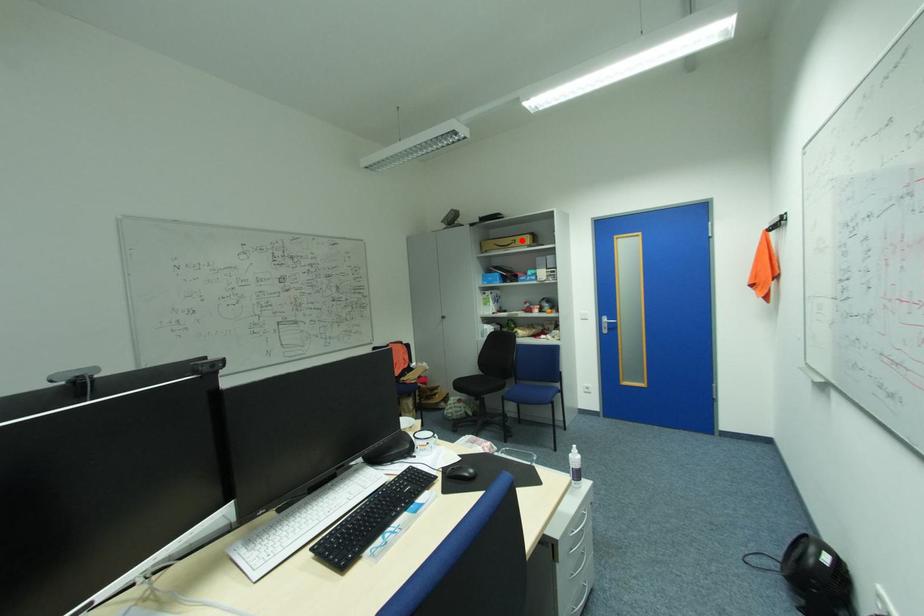
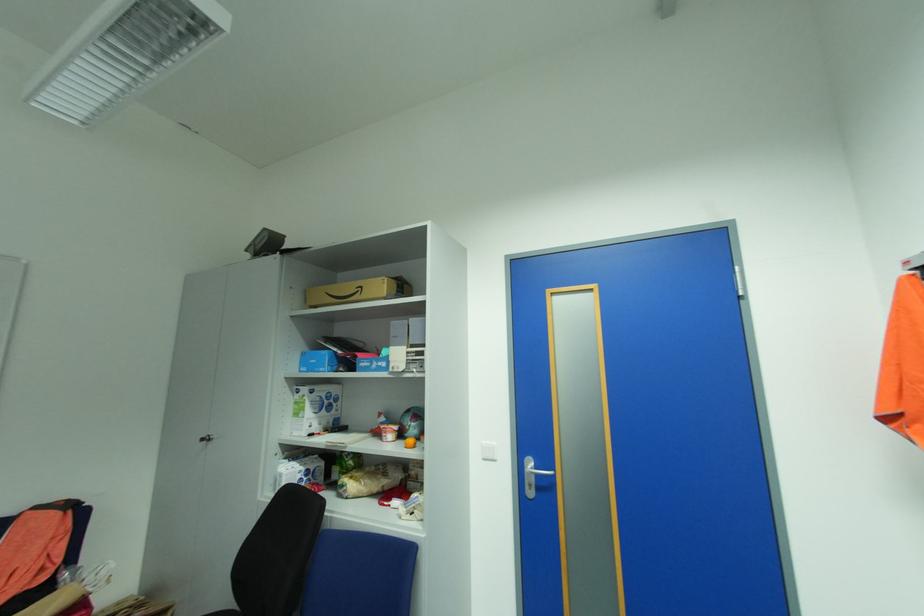
Locate, in the second image, the point that corresponds to the highlighted location in the first image.

(368, 286)